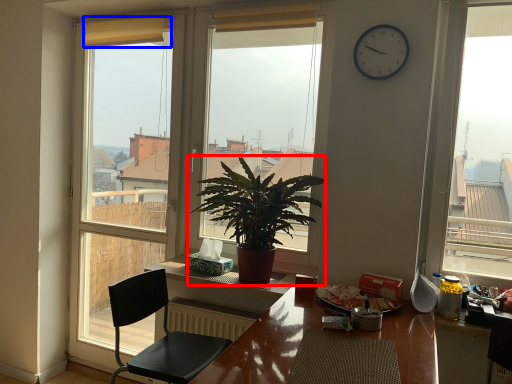
Question: Which object appears farthest to the camera in this image, houseplant (highlighted by a red box) or curtain (highlighted by a blue box)?

Choices:
 (A) houseplant
 (B) curtain

Answer: (B)